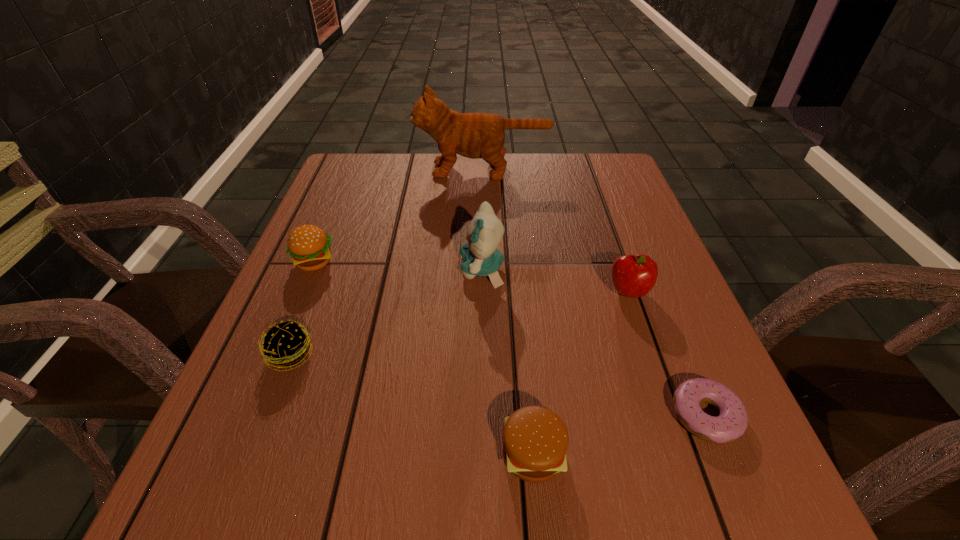
Image resolution: width=960 pixels, height=540 pixels. In order to click on free space located 0.100m on the front of the shortest object in this screenshot , I will do `click(750, 521)`.

In order to click on object present at the far edge in this screenshot , I will do pos(473,135).

In order to click on object that is at the near edge in this screenshot , I will do `click(535, 440)`.

Identify the location of hamburger present at the left edge. Image resolution: width=960 pixels, height=540 pixels. (309, 247).

This screenshot has width=960, height=540. I want to click on patty that is at the left edge, so click(285, 344).

Where is `apple that is at the right edge`? Image resolution: width=960 pixels, height=540 pixels. apple that is at the right edge is located at coordinates (634, 276).

This screenshot has height=540, width=960. Find the location of `doughnut positioned at the right edge`. doughnut positioned at the right edge is located at coordinates (731, 423).

Identify the location of vacant space at the far edge of the desktop. The width and height of the screenshot is (960, 540). (521, 192).

At what (x,y) coordinates should I click in order to perform the action: click on vacant region at the near edge of the desktop. Please return your answer as a coordinate pair (x, y). Looking at the image, I should click on (481, 509).

The image size is (960, 540). Identify the location of free space at the left edge of the desktop. (335, 367).